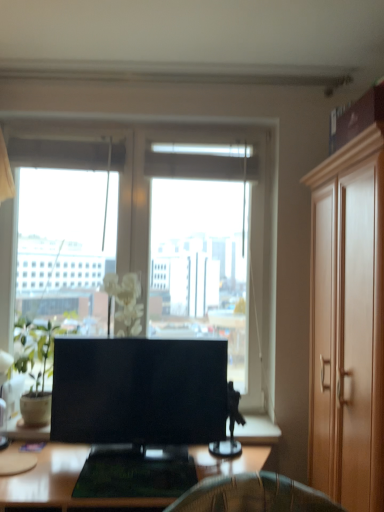
Question: Considering the positions of point (36, 416) and point (380, 222), is point (36, 416) closer or farther from the camera than point (380, 222)?

Choices:
 (A) farther
 (B) closer

Answer: (A)

Question: Is green matte plant at left taller or shorter than light brown wood cabinet at right?

Choices:
 (A) short
 (B) tall

Answer: (A)

Question: Based on their relative distances, which object is farther from the wooden desk at center?

Choices:
 (A) matte black tv at center
 (B) green matte plant at left
 (C) light brown wood cabinet at right

Answer: (C)

Question: Which object is the farthest from the green matte plant at left?

Choices:
 (A) matte black tv at center
 (B) light brown wood cabinet at right
 (C) wooden desk at center

Answer: (B)